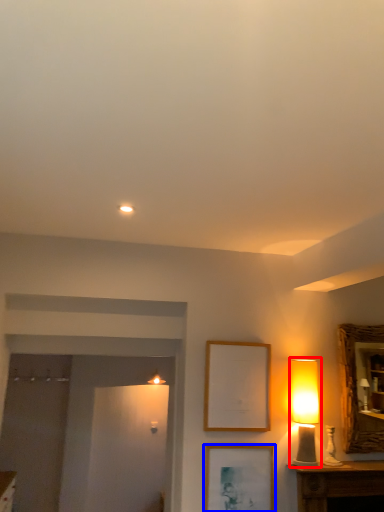
Question: Among these objects, which one is farthest to the camera, table lamp (highlighted by a red box) or picture frame (highlighted by a blue box)?

Choices:
 (A) table lamp
 (B) picture frame

Answer: (A)